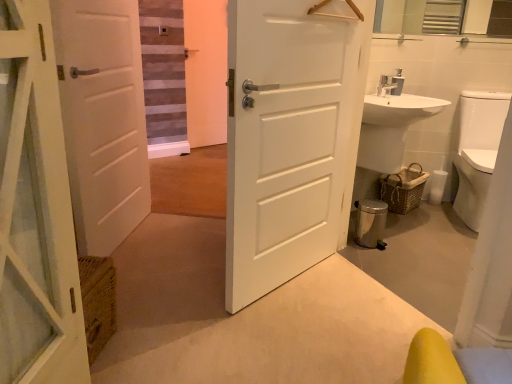
Question: Is white matte door at left, acting as the first door starting from the left, oriented towards woven brown basket at lower right?

Choices:
 (A) yes
 (B) no

Answer: (A)

Question: From the image's perspective, is white matte door at left, placed as the second door when sorted from right to left, located beneath woven brown basket at lower right?

Choices:
 (A) no
 (B) yes

Answer: (A)

Question: Is white matte door at left, acting as the first door starting from the left, in contact with woven brown basket at lower right?

Choices:
 (A) yes
 (B) no

Answer: (B)

Question: Does white matte door at left, acting as the first door starting from the left, have a greater width compared to woven brown basket at lower right?

Choices:
 (A) yes
 (B) no

Answer: (B)

Question: Is white matte door at left, placed as the second door when sorted from right to left, bigger than woven brown basket at lower right?

Choices:
 (A) yes
 (B) no

Answer: (A)

Question: Does white matte door at left, acting as the first door starting from the left, have a greater height compared to woven brown basket at lower right?

Choices:
 (A) no
 (B) yes

Answer: (B)

Question: From the image's perspective, is white matte door at center, which is the 1th door in right-to-left order, on top of woven brown basket at lower right?

Choices:
 (A) no
 (B) yes

Answer: (B)

Question: Considering the relative positions of white matte door at center, the 2th door in the left-to-right sequence, and woven brown basket at lower right in the image provided, is white matte door at center, the 2th door in the left-to-right sequence, to the right of woven brown basket at lower right from the viewer's perspective?

Choices:
 (A) yes
 (B) no

Answer: (B)

Question: Can you confirm if white matte door at center, which is the 1th door in right-to-left order, is thinner than woven brown basket at lower right?

Choices:
 (A) yes
 (B) no

Answer: (A)

Question: Could you tell me if white matte door at center, which is the 1th door in right-to-left order, is turned towards woven brown basket at lower right?

Choices:
 (A) no
 (B) yes

Answer: (A)

Question: From a real-world perspective, is white matte door at center, the 2th door in the left-to-right sequence, over woven brown basket at lower right?

Choices:
 (A) no
 (B) yes

Answer: (B)

Question: Is white matte door at center, the 2th door in the left-to-right sequence, oriented away from woven brown basket at lower right?

Choices:
 (A) yes
 (B) no

Answer: (B)

Question: Would you consider white matte door at left, acting as the first door starting from the left, to be distant from white glossy sink at right?

Choices:
 (A) yes
 (B) no

Answer: (A)